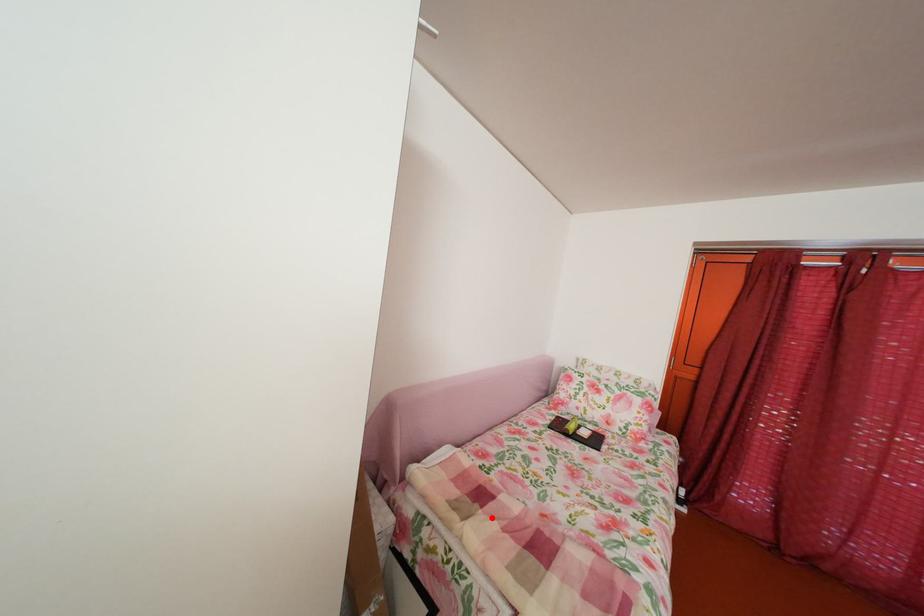
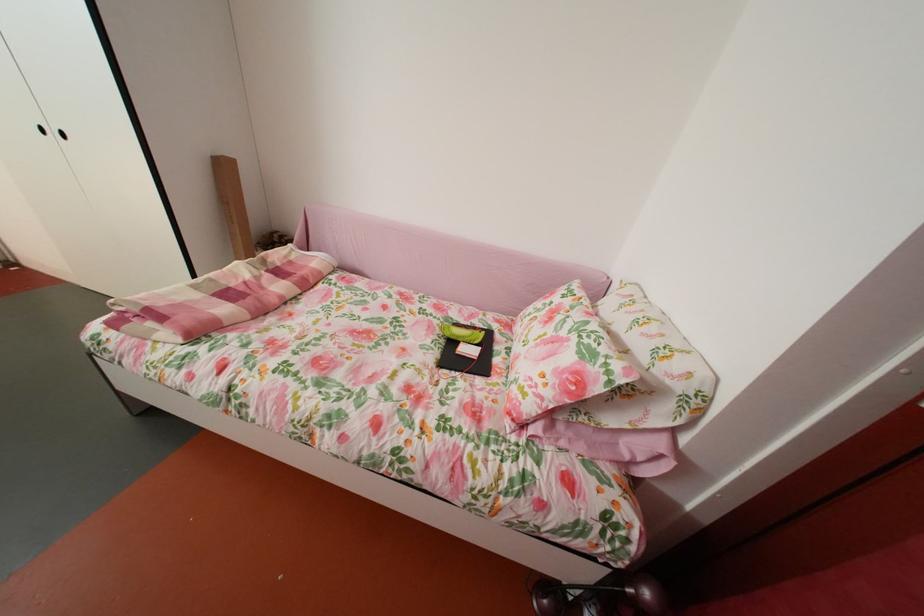
Find the pixel in the second image that matches the highlighted location in the first image.

(274, 278)